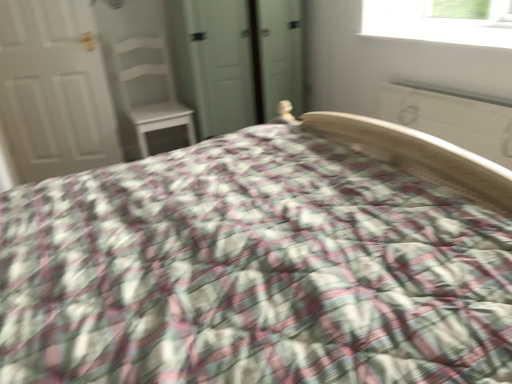
Describe the element at coordinates (264, 263) in the screenshot. The width and height of the screenshot is (512, 384). I see `plaid fabric bed at center` at that location.

Describe the element at coordinates (145, 92) in the screenshot. Image resolution: width=512 pixels, height=384 pixels. I see `white wood chair at upper left` at that location.

Find the location of a particular element. This screenshot has width=512, height=384. white smooth window sill at upper right is located at coordinates (448, 36).

What do you see at coordinates (452, 118) in the screenshot?
I see `white painted wood radiator at upper right` at bounding box center [452, 118].

Measure the distance between white matte door at left and camera.

2.66 meters.

Locate an element on the screen. Image resolution: width=512 pixels, height=384 pixels. plaid fabric bed at center is located at coordinates point(264,263).

Considering the points (252, 94) and (130, 106), which point is in front, point (252, 94) or point (130, 106)?

Point (252, 94)

Considering the sizes of objects green matte wardrobe at center and white wood chair at upper left in the image provided, who is wider, green matte wardrobe at center or white wood chair at upper left?

Wider between the two is green matte wardrobe at center.

Is green matte wardrobe at center smaller than white wood chair at upper left?

Actually, green matte wardrobe at center might be larger than white wood chair at upper left.

Considering the relative sizes of green matte wardrobe at center and white wood chair at upper left in the image provided, is green matte wardrobe at center shorter than white wood chair at upper left?

No, green matte wardrobe at center is not shorter than white wood chair at upper left.

Is white painted wood radiator at upper right to the right of plaid fabric bed at center from the viewer's perspective?

Yes, white painted wood radiator at upper right is to the right of plaid fabric bed at center.

Considering the relative sizes of white painted wood radiator at upper right and plaid fabric bed at center in the image provided, is white painted wood radiator at upper right smaller than plaid fabric bed at center?

Correct, white painted wood radiator at upper right occupies less space than plaid fabric bed at center.

How different are the orientations of white painted wood radiator at upper right and plaid fabric bed at center in degrees?

The angle between the facing direction of white painted wood radiator at upper right and the facing direction of plaid fabric bed at center is 180 degrees.

How distant is white painted wood radiator at upper right from plaid fabric bed at center?

3.38 feet.

In the image, is white smooth window sill at upper right positioned in front of or behind white wood chair at upper left?

In the image, white smooth window sill at upper right appears in front of white wood chair at upper left.

Between white smooth window sill at upper right and white wood chair at upper left, which one has larger size?

With larger size is white wood chair at upper left.

From a real-world perspective, is white smooth window sill at upper right below white wood chair at upper left?

No.

From the image's perspective, relative to white wood chair at upper left, is white smooth window sill at upper right above or below?

Based on their image positions, white smooth window sill at upper right is located above white wood chair at upper left.

Is green matte wardrobe at center not inside plaid fabric bed at center?

Yes, green matte wardrobe at center is not within plaid fabric bed at center.

Can you confirm if green matte wardrobe at center is shorter than plaid fabric bed at center?

Incorrect, the height of green matte wardrobe at center does not fall short of that of plaid fabric bed at center.

Can you tell me how much green matte wardrobe at center and plaid fabric bed at center differ in facing direction?

The facing directions of green matte wardrobe at center and plaid fabric bed at center are 91.6 degrees apart.

Considering the relative sizes of green matte wardrobe at center and plaid fabric bed at center in the image provided, is green matte wardrobe at center smaller than plaid fabric bed at center?

Correct, green matte wardrobe at center occupies less space than plaid fabric bed at center.

Does plaid fabric bed at center have a greater width compared to white painted wood radiator at upper right?

Correct, the width of plaid fabric bed at center exceeds that of white painted wood radiator at upper right.

Measure the distance from plaid fabric bed at center to white painted wood radiator at upper right.

A distance of 3.38 feet exists between plaid fabric bed at center and white painted wood radiator at upper right.

Is plaid fabric bed at center with white painted wood radiator at upper right?

There is a gap between plaid fabric bed at center and white painted wood radiator at upper right.

From the image's perspective, which object appears higher, plaid fabric bed at center or white painted wood radiator at upper right?

From the image's view, white painted wood radiator at upper right is above.

Locate an element on the screen. The height and width of the screenshot is (384, 512). window sill that is behind the plaid fabric bed at center is located at coordinates (448, 36).

Which point is more forward, (x=484, y=34) or (x=205, y=176)?

Point (x=205, y=176)

From the image's perspective, would you say white smooth window sill at upper right is shown under plaid fabric bed at center?

Actually, white smooth window sill at upper right appears above plaid fabric bed at center in the image.

Based on the photo, is plaid fabric bed at center completely or partially inside white smooth window sill at upper right?

No.

Is green matte wardrobe at center at the back of white painted wood radiator at upper right?

No, white painted wood radiator at upper right is not facing away from green matte wardrobe at center.

In the scene shown: From the image's perspective, would you say white painted wood radiator at upper right is shown under green matte wardrobe at center?

Indeed, from the image's perspective, white painted wood radiator at upper right is shown beneath green matte wardrobe at center.

From the picture: Which of these two, white painted wood radiator at upper right or green matte wardrobe at center, is bigger?

With larger size is green matte wardrobe at center.

I want to click on chair below the green matte wardrobe at center (from a real-world perspective), so click(145, 92).

This screenshot has width=512, height=384. Find the location of `bed that is in front of the white painted wood radiator at upper right`. bed that is in front of the white painted wood radiator at upper right is located at coordinates (264, 263).

From the picture: When comparing their distances from green matte wardrobe at center, does plaid fabric bed at center or white painted wood radiator at upper right seem closer?

Among the two, white painted wood radiator at upper right is located nearer to green matte wardrobe at center.

When comparing their distances from plaid fabric bed at center, does white painted wood radiator at upper right or white smooth window sill at upper right seem closer?

white painted wood radiator at upper right.

When comparing their distances from white wood chair at upper left, does white painted wood radiator at upper right or plaid fabric bed at center seem closer?

white painted wood radiator at upper right is closer to white wood chair at upper left.

From the image, which object appears to be farther from green matte wardrobe at center, white painted wood radiator at upper right or white matte door at left?

Among the two, white painted wood radiator at upper right is located further to green matte wardrobe at center.

When comparing their distances from white matte door at left, does plaid fabric bed at center or white smooth window sill at upper right seem closer?

Based on the image, plaid fabric bed at center appears to be nearer to white matte door at left.

Looking at the image, which one is located further to white matte door at left, white smooth window sill at upper right or white wood chair at upper left?

white smooth window sill at upper right.

Based on their spatial positions, is white matte door at left or white painted wood radiator at upper right further from white wood chair at upper left?

The object further to white wood chair at upper left is white painted wood radiator at upper right.

Looking at this image, estimate the real-world distances between objects in this image. Which object is further from white painted wood radiator at upper right, white matte door at left or white wood chair at upper left?

white matte door at left.

The height and width of the screenshot is (384, 512). Find the location of `screen door located between white matte door at left and white painted wood radiator at upper right in the left-right direction`. screen door located between white matte door at left and white painted wood radiator at upper right in the left-right direction is located at coordinates (244, 60).

You are a GUI agent. You are given a task and a screenshot of the screen. Output one action in this format:
    pyautogui.click(x=<x>, y=<y>)
    Task: Click on the screen door between white wood chair at upper left and white smooth window sill at upper right from left to right
    This screenshot has width=512, height=384.
    Given the screenshot: What is the action you would take?
    (244, 60)

Where is `window sill between plaid fabric bed at center and green matte wardrobe at center in the front-back direction`? window sill between plaid fabric bed at center and green matte wardrobe at center in the front-back direction is located at coordinates (448, 36).

Locate an element on the screen. window sill between plaid fabric bed at center and white wood chair at upper left from front to back is located at coordinates (448, 36).